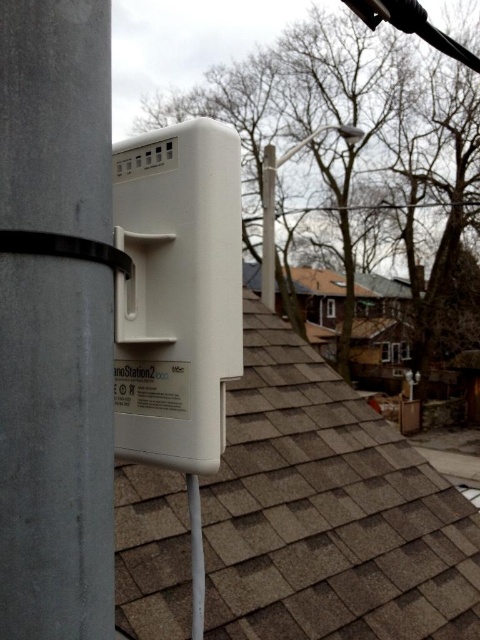
The image size is (480, 640). What are the coordinates of `brown shingles at center` in the screenshot? It's located at (327, 512).

Can you confirm if brown shingles at center is shorter than white plastic pole at center?

Incorrect, brown shingles at center's height does not fall short of white plastic pole at center's.

Image resolution: width=480 pixels, height=640 pixels. Describe the element at coordinates (327, 512) in the screenshot. I see `brown shingles at center` at that location.

You are a GUI agent. You are given a task and a screenshot of the screen. Output one action in this format:
    pyautogui.click(x=<x>, y=<y>)
    Task: Click on the brown shingles at center
    This screenshot has width=480, height=640.
    Given the screenshot: What is the action you would take?
    (x=327, y=512)

Does white plastic pole at center lie behind white plastic lamp post at upper center?

No.

Is white plastic pole at center thinner than white plastic lamp post at upper center?

Yes, white plastic pole at center is thinner than white plastic lamp post at upper center.

The height and width of the screenshot is (640, 480). What are the coordinates of `white plastic pole at center` in the screenshot? It's located at (56, 323).

Describe the element at coordinates (327, 512) in the screenshot. This screenshot has height=640, width=480. I see `brown shingles at center` at that location.

Who is positioned more to the left, brown shingles at center or white plastic lamp post at upper center?

brown shingles at center is more to the left.

What do you see at coordinates (327, 512) in the screenshot? This screenshot has height=640, width=480. I see `brown shingles at center` at bounding box center [327, 512].

The height and width of the screenshot is (640, 480). I want to click on brown shingles at center, so click(x=327, y=512).